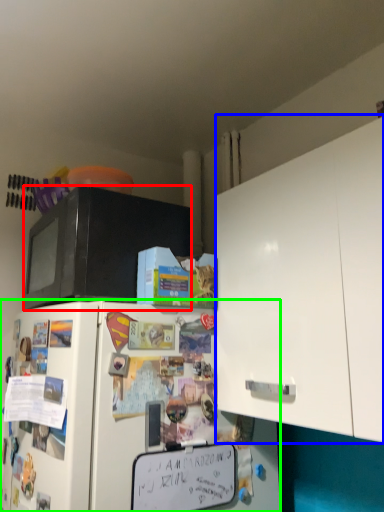
Question: Which object is positioned closest to microwave oven (highlighted by a red box)? Select from cabinetry (highlighted by a blue box) and refrigerator (highlighted by a green box).

Choices:
 (A) cabinetry
 (B) refrigerator

Answer: (B)